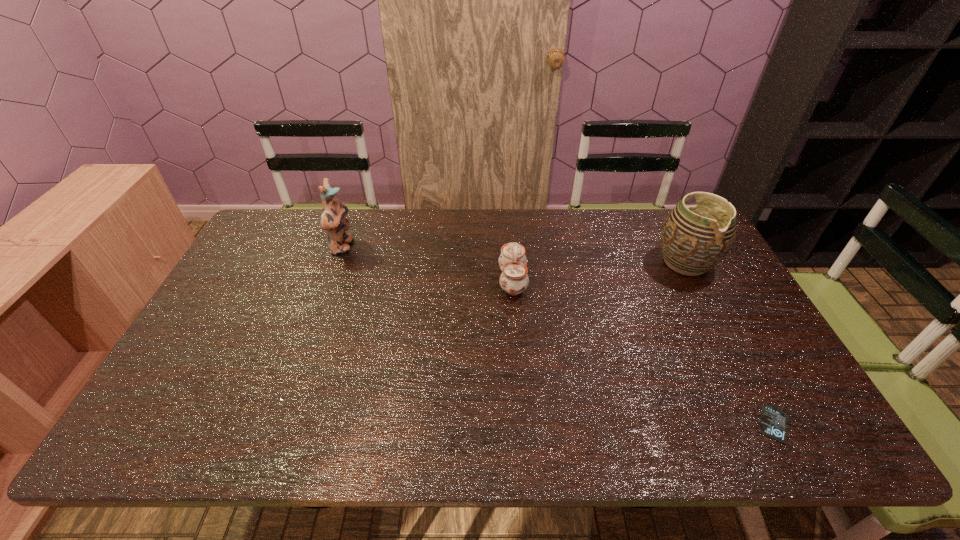
You are a GUI agent. You are given a task and a screenshot of the screen. Output one action in this format:
    pyautogui.click(x=<x>, y=<y>)
    Task: Click on the free space in the image that satisfies the following two spatial constraints: 1. by the handle of the second object from left to right; 2. on the right side of the identity card
    This screenshot has width=960, height=540.
    Given the screenshot: What is the action you would take?
    pyautogui.click(x=524, y=424)

Find the location of a particular element. This screenshot has height=540, width=960. free space that satisfies the following two spatial constraints: 1. on the back side of the shortest object; 2. on the front-facing side of the leftmost object is located at coordinates (681, 247).

I want to click on vacant space that satisfies the following two spatial constraints: 1. on the front-facing side of the pottery; 2. on the left side of the figurine, so click(337, 263).